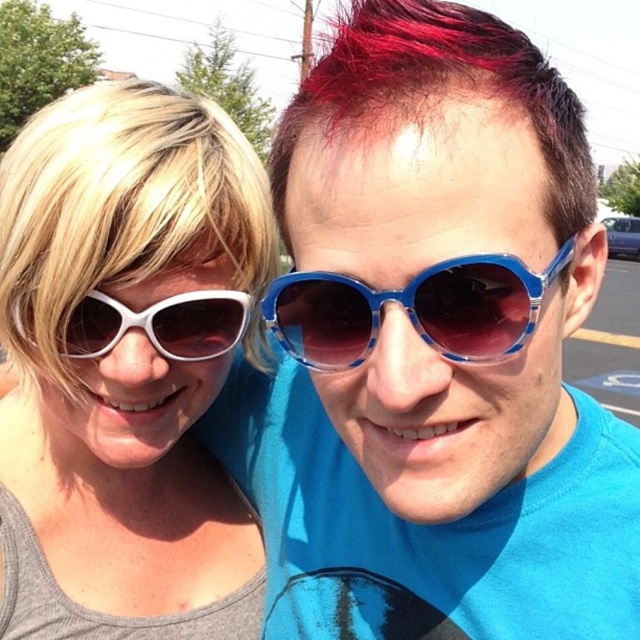
The image size is (640, 640). Identify the location of white plastic sunglasses at upper left. (125, 365).

Is white plastic sunglasses at upper left to the left of shiny red hair at upper center from the viewer's perspective?

Indeed, white plastic sunglasses at upper left is positioned on the left side of shiny red hair at upper center.

I want to click on white plastic sunglasses at upper left, so click(125, 365).

From the picture: Does shiny red hair at upper center appear under white plastic sunglasses at left?

No.

Is point (570, 116) in front of point (248, 296)?

Yes, it is.

Who is more distant from viewer, (282, 205) or (70, 330)?

Point (70, 330)

At what (x,y) coordinates should I click in order to perform the action: click on shiny red hair at upper center. Please return your answer as a coordinate pair (x, y). The height and width of the screenshot is (640, 640). Looking at the image, I should click on (440, 90).

Is blue acetate sunglasses at center shorter than white plastic sunglasses at left?

No, blue acetate sunglasses at center is not shorter than white plastic sunglasses at left.

At what (x,y) coordinates should I click in order to perform the action: click on blue acetate sunglasses at center. Please return your answer as a coordinate pair (x, y). Looking at the image, I should click on (412, 308).